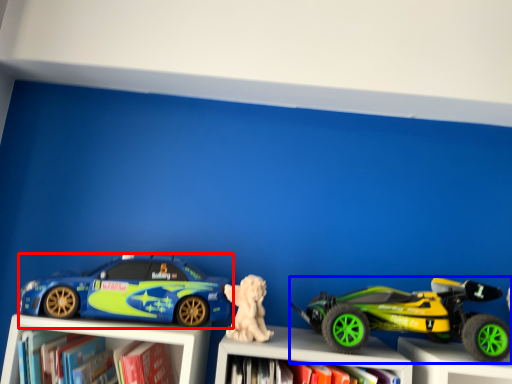
Question: Which object appears farthest to the camera in this image, car (highlighted by a red box) or toy (highlighted by a blue box)?

Choices:
 (A) car
 (B) toy

Answer: (A)